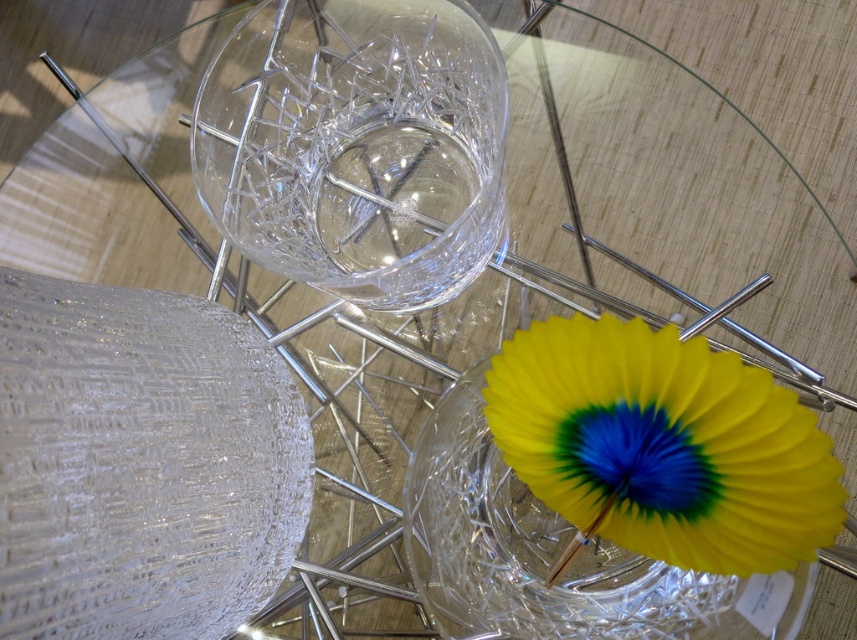
Question: Is transparent crystal vase at upper center wider than yellow paper fan at lower right?

Choices:
 (A) no
 (B) yes

Answer: (B)

Question: Which point appears farthest from the camera in this image?

Choices:
 (A) (536, 496)
 (B) (373, 268)

Answer: (B)

Question: Does transparent crystal vase at upper center appear under yellow paper fan at lower right?

Choices:
 (A) yes
 (B) no

Answer: (B)

Question: Which point appears closest to the camera in this image?

Choices:
 (A) (446, 236)
 (B) (632, 348)

Answer: (B)

Question: Is transparent crystal vase at upper center smaller than yellow paper fan at lower right?

Choices:
 (A) yes
 (B) no

Answer: (B)